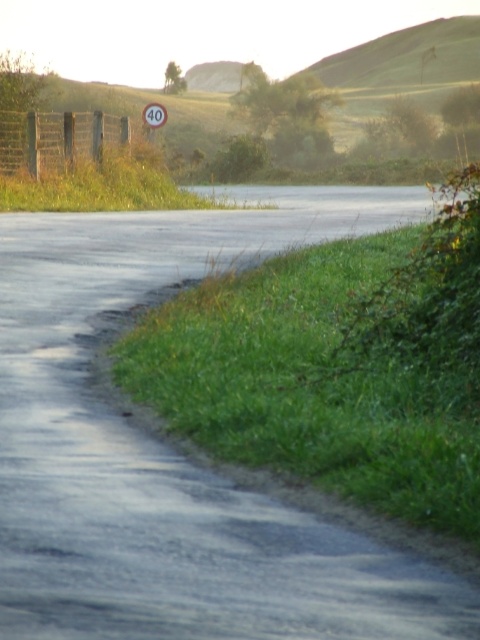
Question: Is smooth asphalt road at center wider than white plastic sign at upper center?

Choices:
 (A) no
 (B) yes

Answer: (B)

Question: Which point is farther from the camera taking this photo?

Choices:
 (A) (377, 216)
 (B) (419, 40)

Answer: (B)

Question: Which point is farther from the camera taking this photo?

Choices:
 (A) (145, 108)
 (B) (33, 388)
 (C) (325, 61)

Answer: (C)

Question: Based on their relative distances, which object is nearer to the white plastic sign at upper center?

Choices:
 (A) smooth asphalt road at center
 (B) green grassy hill at upper center

Answer: (A)

Question: Does green grassy hill at upper center appear under white plastic sign at upper center?

Choices:
 (A) no
 (B) yes

Answer: (A)

Question: Considering the relative positions of smooth asphalt road at center and green grassy hill at upper center in the image provided, where is smooth asphalt road at center located with respect to green grassy hill at upper center?

Choices:
 (A) above
 (B) below

Answer: (B)